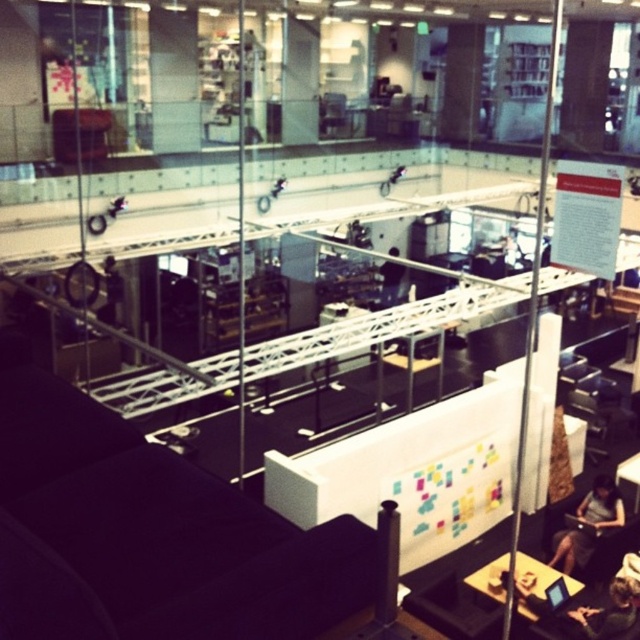
The image size is (640, 640). What do you see at coordinates (109, 291) in the screenshot?
I see `black leather jacket at center` at bounding box center [109, 291].

Does black leather jacket at center appear over black plastic laptop at lower right?

Indeed, black leather jacket at center is positioned over black plastic laptop at lower right.

This screenshot has height=640, width=640. What do you see at coordinates (109, 291) in the screenshot?
I see `black leather jacket at center` at bounding box center [109, 291].

This screenshot has height=640, width=640. I want to click on black leather jacket at center, so click(x=109, y=291).

Who is positioned more to the left, black fabric person at center or black plastic laptop at lower right?

Positioned to the left is black fabric person at center.

Is point (390, 288) closer to viewer compared to point (593, 534)?

No.

At what (x,y) coordinates should I click in order to perform the action: click on black fabric person at center. Please return your answer as a coordinate pair (x, y). Looking at the image, I should click on pos(390,282).

Does dark hair person at lower right have a lesser height compared to black leather jacket at center?

Yes, dark hair person at lower right is shorter than black leather jacket at center.

Does dark hair person at lower right have a lesser width compared to black leather jacket at center?

No, dark hair person at lower right is not thinner than black leather jacket at center.

Is point (620, 620) positioned after point (113, 284)?

No, (620, 620) is closer to viewer.

Image resolution: width=640 pixels, height=640 pixels. What are the coordinates of `dark hair person at lower right` in the screenshot? It's located at (609, 611).